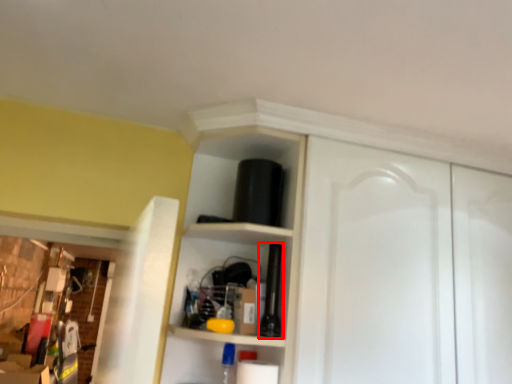
Question: From the image's perspective, where is bottle (annotated by the red box) located in relation to dresser in the image?

Choices:
 (A) below
 (B) above

Answer: (A)